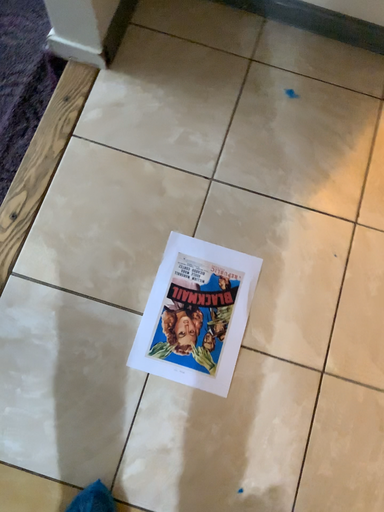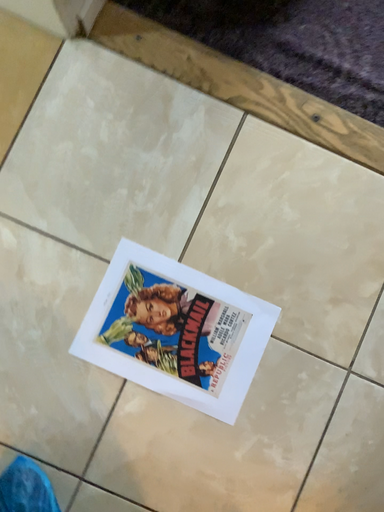
Question: How did the camera likely rotate when shooting the video?

Choices:
 (A) rotated upward
 (B) rotated downward

Answer: (A)